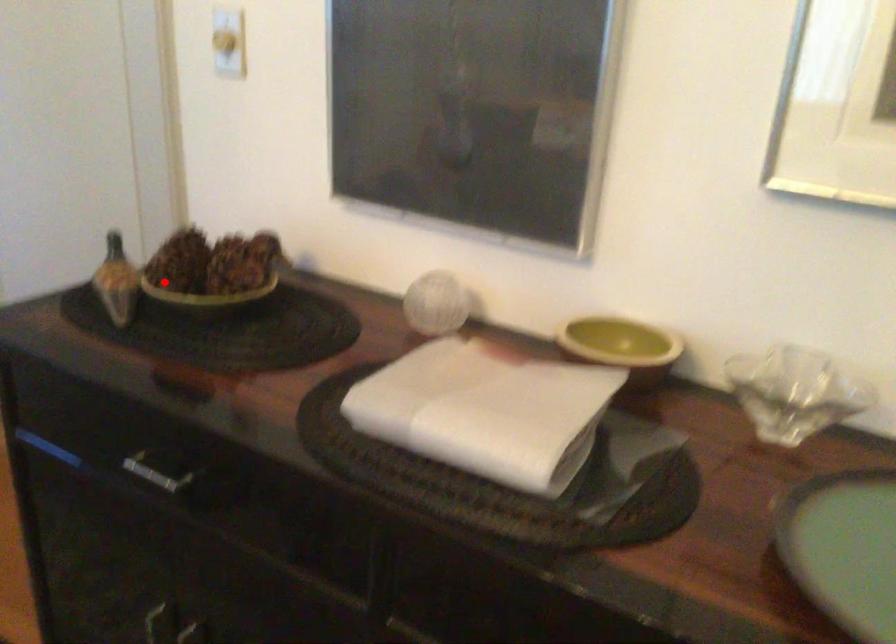
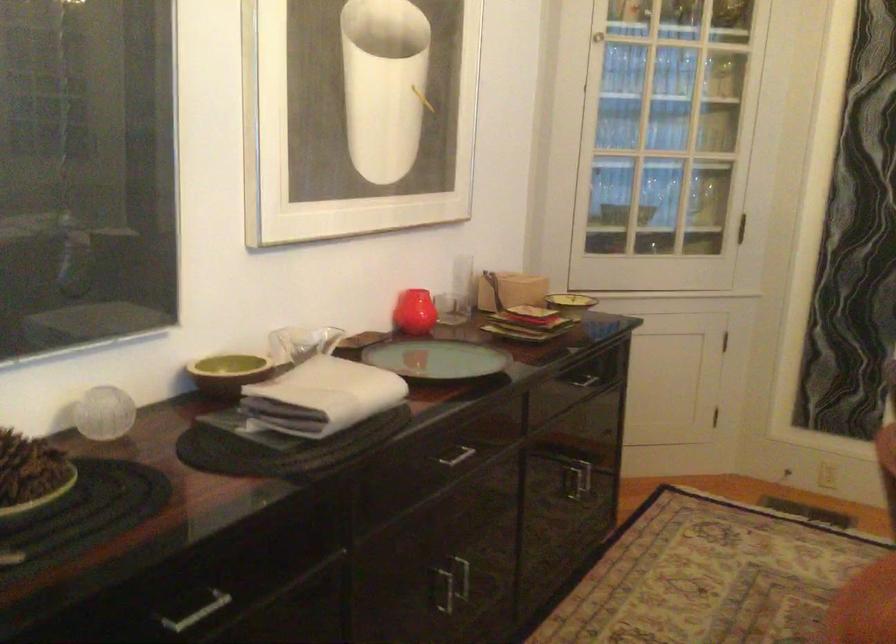
Where in the second image is the point corresponding to the highlighted location from the first image?

(30, 475)